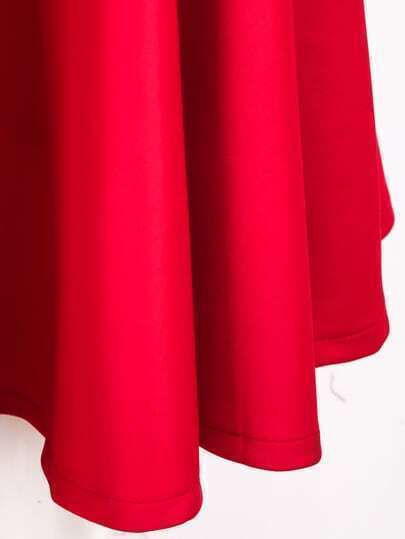
In order to click on fabric in this screenshot , I will do `click(263, 307)`.